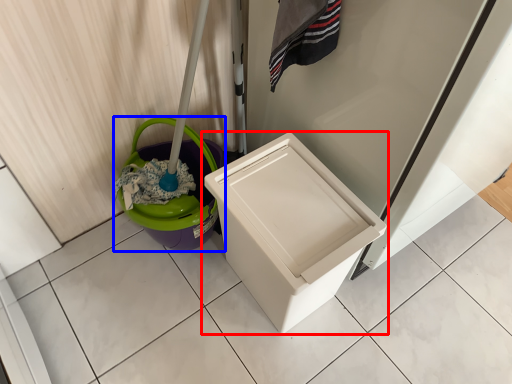
Question: Which object appears closest to the camera in this image, waste container (highlighted by a red box) or potty (highlighted by a blue box)?

Choices:
 (A) waste container
 (B) potty

Answer: (A)